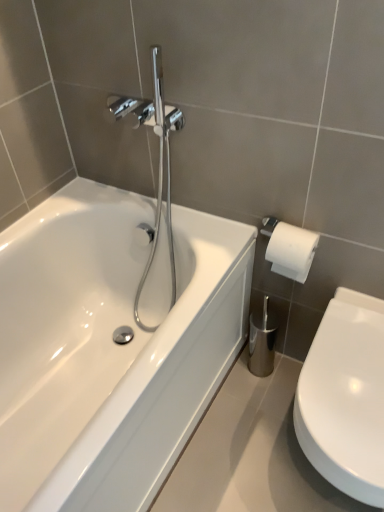
Describe the element at coordinates (110, 345) in the screenshot. The width and height of the screenshot is (384, 512). I see `white glossy bathtub at left` at that location.

I want to click on white glossy bathtub at left, so click(110, 345).

The width and height of the screenshot is (384, 512). Identify the location of white glossy toilet at lower right. (345, 397).

In order to face white glossy toilet at lower right, should I rotate leftwards or rightwards?

It's best to rotate right around 21.065 degrees.

What do you see at coordinates (345, 397) in the screenshot?
I see `white glossy toilet at lower right` at bounding box center [345, 397].

Where is `white glossy bathtub at left`? white glossy bathtub at left is located at coordinates (110, 345).

Considering the positions of objects white glossy toilet at lower right and white glossy bathtub at left in the image provided, who is more to the left, white glossy toilet at lower right or white glossy bathtub at left?

white glossy bathtub at left is more to the left.

Considering the relative positions of white glossy toilet at lower right and white glossy bathtub at left in the image provided, is white glossy toilet at lower right in front of white glossy bathtub at left?

No, it is not.

Which is further, [366,362] or [122,367]?

The point [122,367] is more distant.

In the scene shown: From the image's perspective, would you say white glossy toilet at lower right is shown under white glossy bathtub at left?

Correct, white glossy toilet at lower right appears lower than white glossy bathtub at left in the image.

From a real-world perspective, is white glossy toilet at lower right positioned under white glossy bathtub at left based on gravity?

Yes, from a real-world perspective, white glossy toilet at lower right is beneath white glossy bathtub at left.

Between white glossy toilet at lower right and white glossy bathtub at left, which one has smaller width?

white glossy toilet at lower right is thinner.

Considering the relative sizes of white glossy toilet at lower right and white glossy bathtub at left in the image provided, is white glossy toilet at lower right taller than white glossy bathtub at left?

No.

Does white glossy toilet at lower right have a larger size compared to white glossy bathtub at left?

Incorrect, white glossy toilet at lower right is not larger than white glossy bathtub at left.

Would you say white glossy bathtub at left is part of white glossy toilet at lower right's contents?

No, white glossy bathtub at left is located outside of white glossy toilet at lower right.

Is white glossy toilet at lower right next to white glossy bathtub at left and touching it?

There is a gap between white glossy toilet at lower right and white glossy bathtub at left.

Is white glossy toilet at lower right looking in the opposite direction of white glossy bathtub at left?

That's not correct — white glossy toilet at lower right is not looking away from white glossy bathtub at left.

How much distance is there between white glossy toilet at lower right and white glossy bathtub at left?

A distance of 19.92 inches exists between white glossy toilet at lower right and white glossy bathtub at left.

Where is `toilet on the right side of white glossy bathtub at left`? The height and width of the screenshot is (512, 384). toilet on the right side of white glossy bathtub at left is located at coordinates (345, 397).

Is white glossy bathtub at left to the left of white glossy toilet at lower right from the viewer's perspective?

Indeed, white glossy bathtub at left is positioned on the left side of white glossy toilet at lower right.

Consider the image. In the image, is white glossy bathtub at left positioned in front of or behind white glossy toilet at lower right?

white glossy bathtub at left is positioned closer to the viewer than white glossy toilet at lower right.

Considering the points (101, 185) and (339, 303), which point is in front, point (101, 185) or point (339, 303)?

Point (339, 303)

Based on the photo, from the image's perspective, is white glossy bathtub at left beneath white glossy toilet at lower right?

Incorrect, from the image's perspective, white glossy bathtub at left is higher than white glossy toilet at lower right.

From a real-world perspective, which is physically above, white glossy bathtub at left or white glossy toilet at lower right?

white glossy bathtub at left is physically above.

From the picture: Between white glossy bathtub at left and white glossy toilet at lower right, which one has larger width?

Wider between the two is white glossy bathtub at left.

Between white glossy bathtub at left and white glossy toilet at lower right, which one has less height?

white glossy toilet at lower right is shorter.

Is white glossy bathtub at left bigger than white glossy toilet at lower right?

Indeed, white glossy bathtub at left has a larger size compared to white glossy toilet at lower right.

Is white glossy bathtub at left not inside white glossy toilet at lower right?

Yes, white glossy bathtub at left is not within white glossy toilet at lower right.

Would you consider white glossy bathtub at left to be distant from white glossy toilet at lower right?

white glossy bathtub at left is actually quite close to white glossy toilet at lower right.

Is white glossy bathtub at left facing towards white glossy toilet at lower right?

Yes, white glossy bathtub at left is facing white glossy toilet at lower right.

What's the angular difference between white glossy bathtub at left and white glossy toilet at lower right's facing directions?

white glossy bathtub at left and white glossy toilet at lower right are facing 89.9 degrees away from each other.

How distant is white glossy bathtub at left from white glossy toilet at lower right?

white glossy bathtub at left and white glossy toilet at lower right are 19.92 inches apart from each other.

Where is `bathtub located on the left of white glossy toilet at lower right`? bathtub located on the left of white glossy toilet at lower right is located at coordinates (110, 345).

I want to click on bathtub that appears above the white glossy toilet at lower right (from the image's perspective), so click(110, 345).

The width and height of the screenshot is (384, 512). I want to click on bathtub in front of the white glossy toilet at lower right, so click(110, 345).